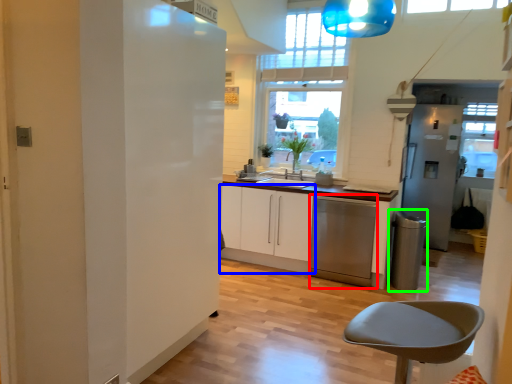
Question: Which object is positioned closest to dish washer (highlighted by a red box)? Select from cabinetry (highlighted by a blue box) and appliance (highlighted by a green box).

Choices:
 (A) cabinetry
 (B) appliance

Answer: (A)